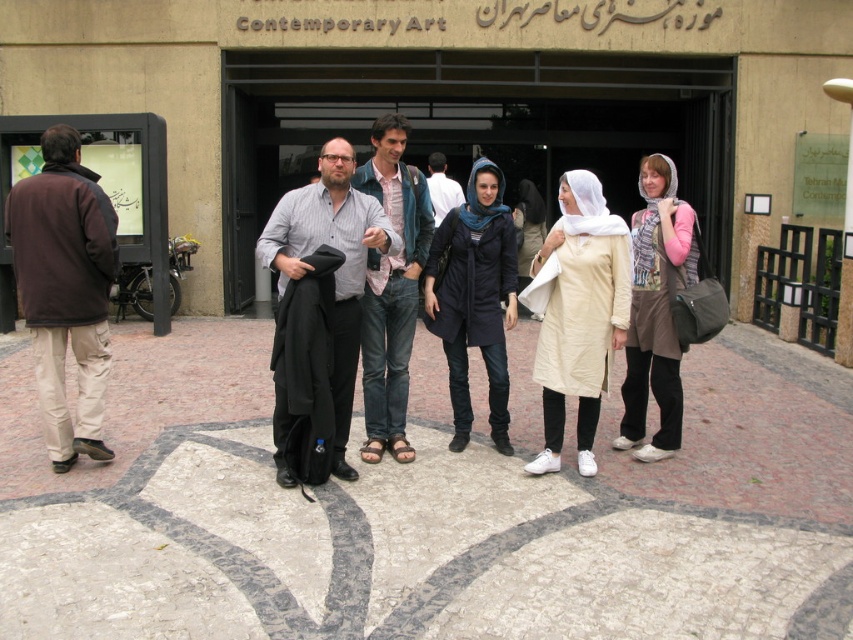
Between point (392, 173) and point (668, 200), which one is positioned behind?

Positioned behind is point (392, 173).

Locate an element on the screen. Image resolution: width=853 pixels, height=640 pixels. denim jeans at center is located at coordinates (392, 289).

Is denim jeans at center closer to camera compared to light beige fabric dress at center?

Yes.

Does denim jeans at center have a greater width compared to light beige fabric dress at center?

In fact, denim jeans at center might be narrower than light beige fabric dress at center.

This screenshot has width=853, height=640. I want to click on denim jeans at center, so click(392, 289).

The width and height of the screenshot is (853, 640). Find the location of `denim jeans at center`. denim jeans at center is located at coordinates (392, 289).

Between dark blue fabric hijab at center and denim jeans at center, which one has more height?

With more height is denim jeans at center.

Who is shorter, dark blue fabric hijab at center or denim jeans at center?

With less height is dark blue fabric hijab at center.

Does point (498, 403) come in front of point (366, 333)?

No, it is not.

Image resolution: width=853 pixels, height=640 pixels. What are the coordinates of `dark blue fabric hijab at center` in the screenshot? It's located at (474, 298).